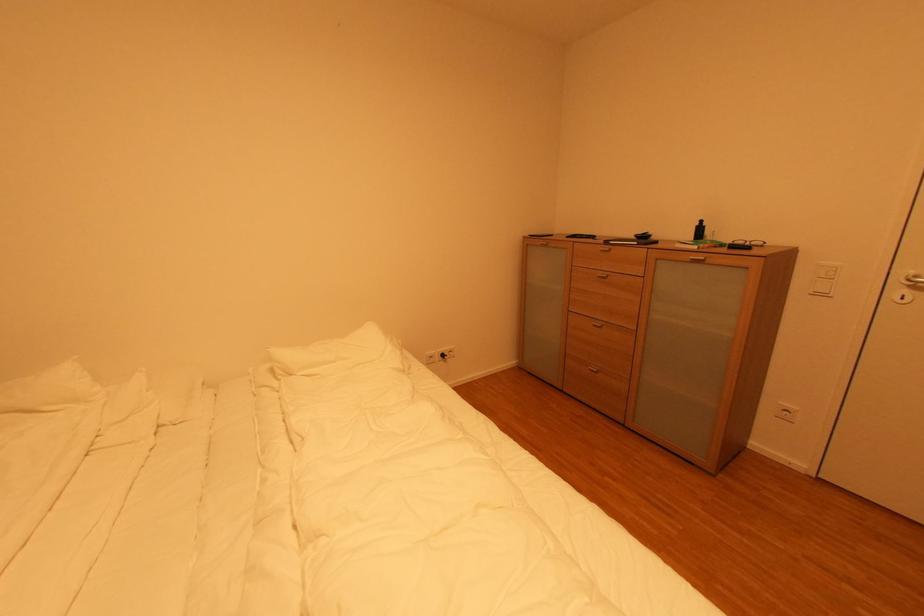
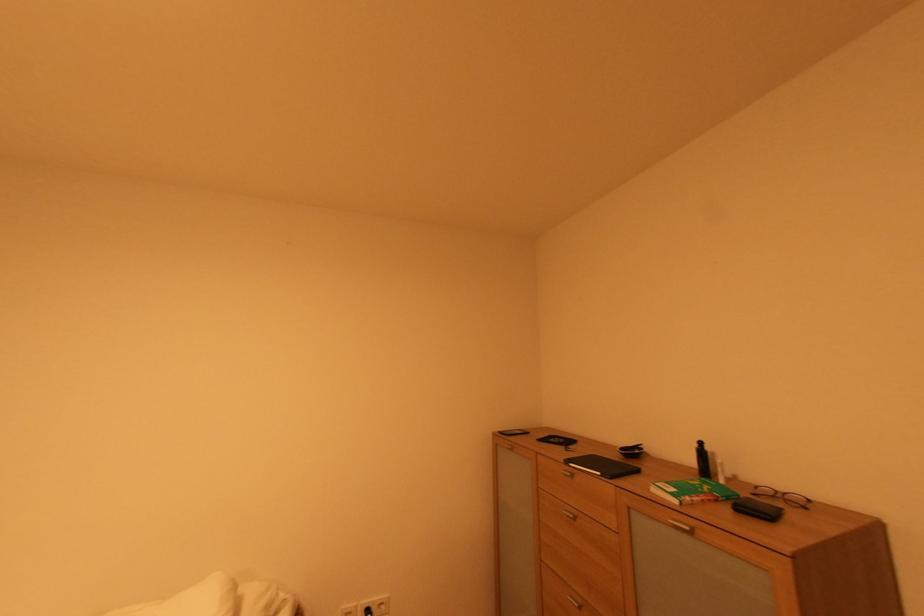
In the second image, find the point that corresponds to (709,259) in the first image.

(694, 530)